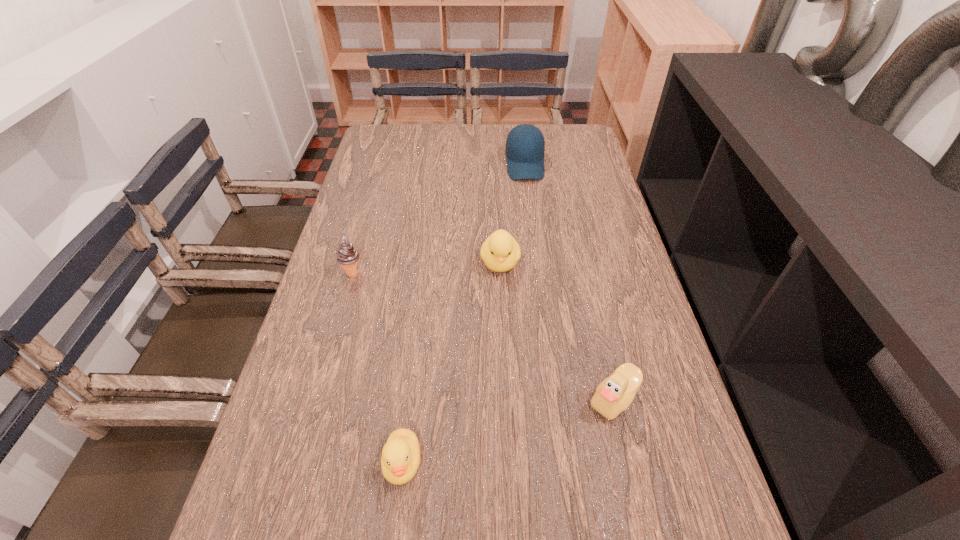
Find the location of a particular element. baseball cap is located at coordinates (525, 146).

Locate an element on the screen. the second duck from left to right is located at coordinates (500, 252).

Locate an element on the screen. This screenshot has height=540, width=960. the leftmost object is located at coordinates (347, 255).

The height and width of the screenshot is (540, 960). I want to click on the second farthest duck, so click(x=613, y=395).

You are a GUI agent. You are given a task and a screenshot of the screen. Output one action in this format:
    pyautogui.click(x=<x>, y=<y>)
    Task: Click on the fourth farthest object
    The height and width of the screenshot is (540, 960).
    Given the screenshot: What is the action you would take?
    pyautogui.click(x=613, y=395)

Find the location of a particular element. This screenshot has width=960, height=540. the fourth object from right to left is located at coordinates pos(400,459).

Locate an element on the screen. the leftmost duck is located at coordinates (400, 459).

At what (x,y) coordinates should I click in order to perform the action: click on free location located 0.160m on the front-facing side of the farthest object. Please return your answer as a coordinate pair (x, y). Looking at the image, I should click on (531, 214).

Locate an element on the screen. vacant region located 0.070m on the front-facing side of the second duck from left to right is located at coordinates (502, 301).

This screenshot has height=540, width=960. Find the location of `free spot located 0.330m on the back of the leftmost object`. free spot located 0.330m on the back of the leftmost object is located at coordinates (375, 193).